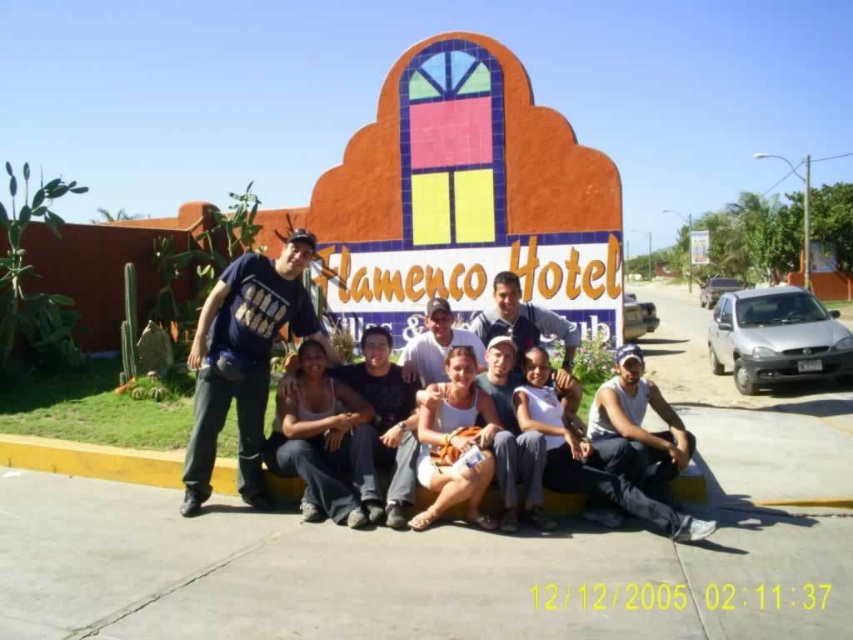
Question: Is white fabric tank top at center wider than matte blue shirt at center?

Choices:
 (A) no
 (B) yes

Answer: (A)

Question: Can you confirm if dark blue t-shirt at left is smaller than matte blue shirt at center?

Choices:
 (A) no
 (B) yes

Answer: (A)

Question: Which point appears closest to the camera in this image?

Choices:
 (A) (689, 234)
 (B) (549, 333)

Answer: (B)

Question: Which point is closer to the camera?

Choices:
 (A) (788, 352)
 (B) (732, 280)

Answer: (A)

Question: Is the position of dark blue t-shirt at left more distant than that of silver metallic sedan at center?

Choices:
 (A) no
 (B) yes

Answer: (A)

Question: Which object is closer to the camera taking this photo?

Choices:
 (A) silver metallic sedan at center
 (B) white fabric sign at center
 (C) matte blue shirt at center

Answer: (C)